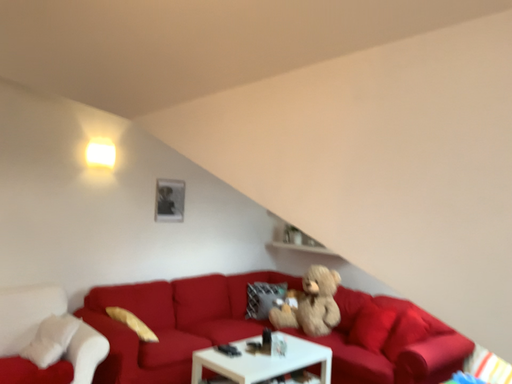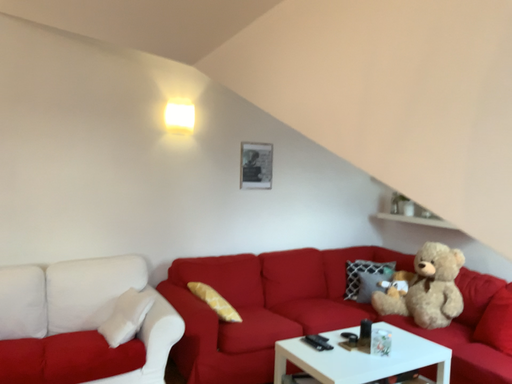
Question: How did the camera likely rotate when shooting the video?

Choices:
 (A) rotated left
 (B) rotated right

Answer: (A)